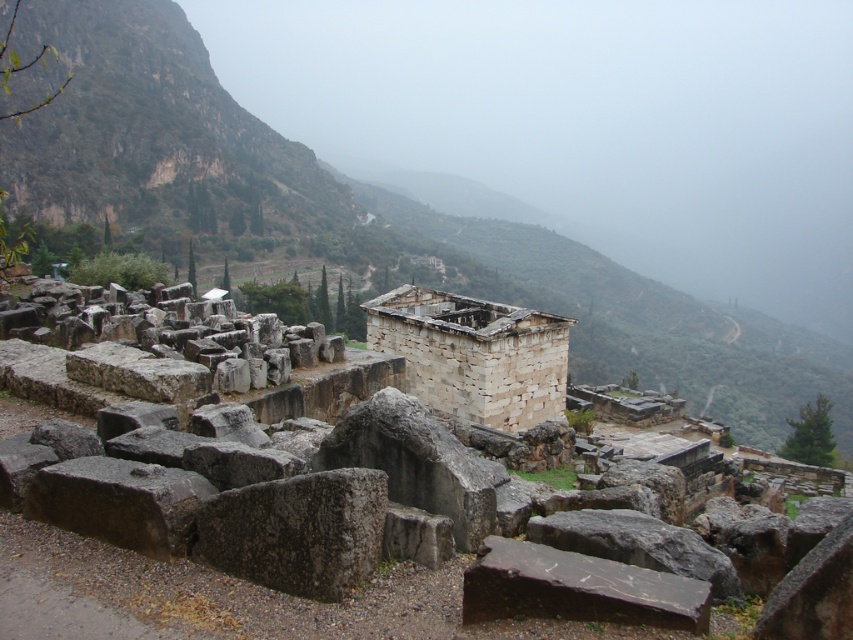
Between gray stone mountain at upper left and gray stone wall at center, which one appears on the left side from the viewer's perspective?

Positioned to the left is gray stone wall at center.

Identify the location of gray stone mountain at upper left. (x=358, y=220).

Describe the element at coordinates (358, 220) in the screenshot. I see `gray stone mountain at upper left` at that location.

Does point (576, 348) come closer to viewer compared to point (84, 74)?

No, (576, 348) is further to viewer.

Who is more forward, (769, 428) or (111, 176)?

Point (111, 176) is more forward.

This screenshot has height=640, width=853. In order to click on gray stone mountain at upper left in this screenshot , I will do click(x=358, y=220).

Which is in front, point (189, 33) or point (432, 292)?

Point (432, 292) is in front.

Locate an element on the screen. This screenshot has width=853, height=640. rugged stone mountain at upper left is located at coordinates (148, 128).